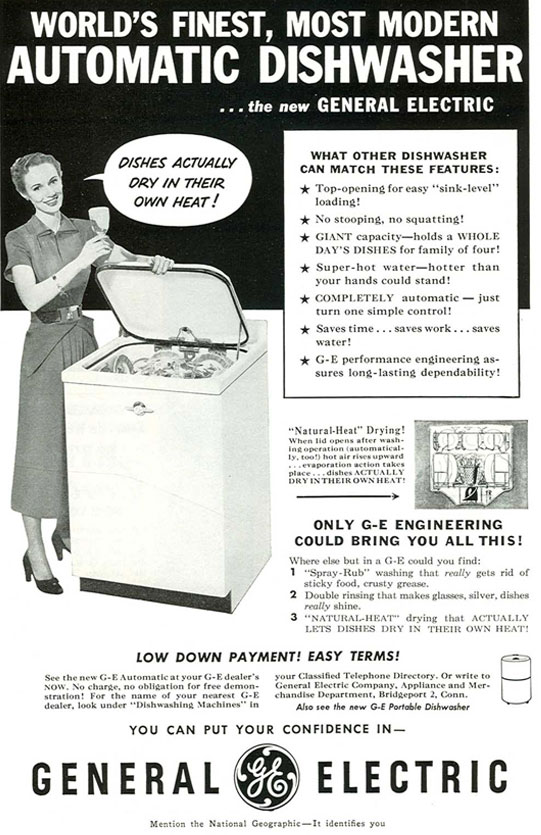
The image size is (541, 835). In order to click on dishwasher in this screenshot , I will do `click(177, 387)`.